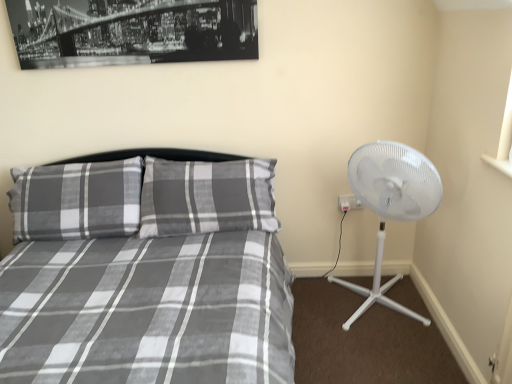
Question: From the image's perspective, would you say black matte print at upper center is positioned over gray plaid bed at center?

Choices:
 (A) yes
 (B) no

Answer: (A)

Question: Considering the relative positions of black matte print at upper center and gray plaid bed at center in the image provided, is black matte print at upper center to the left of gray plaid bed at center from the viewer's perspective?

Choices:
 (A) no
 (B) yes

Answer: (B)

Question: Is gray plaid bed at center located within black matte print at upper center?

Choices:
 (A) no
 (B) yes

Answer: (A)

Question: Does black matte print at upper center have a larger size compared to gray plaid bed at center?

Choices:
 (A) no
 (B) yes

Answer: (A)

Question: Considering the relative sizes of black matte print at upper center and gray plaid bed at center in the image provided, is black matte print at upper center wider than gray plaid bed at center?

Choices:
 (A) no
 (B) yes

Answer: (A)

Question: From the image's perspective, is black matte print at upper center located beneath gray plaid bed at center?

Choices:
 (A) no
 (B) yes

Answer: (A)

Question: Does plaid fabric pillow at left turn towards gray plaid bed at center?

Choices:
 (A) yes
 (B) no

Answer: (A)

Question: From a real-world perspective, does plaid fabric pillow at left sit lower than gray plaid bed at center?

Choices:
 (A) no
 (B) yes

Answer: (A)

Question: Does plaid fabric pillow at left have a lesser width compared to gray plaid bed at center?

Choices:
 (A) no
 (B) yes

Answer: (B)

Question: Can you confirm if plaid fabric pillow at left is taller than gray plaid bed at center?

Choices:
 (A) no
 (B) yes

Answer: (A)

Question: From a real-world perspective, is plaid fabric pillow at left located higher than gray plaid bed at center?

Choices:
 (A) no
 (B) yes

Answer: (B)

Question: Is plaid fabric pillow at left far from gray plaid bed at center?

Choices:
 (A) yes
 (B) no

Answer: (B)

Question: Can you confirm if plaid fabric pillow at left is taller than white plastic fan at right?

Choices:
 (A) no
 (B) yes

Answer: (A)